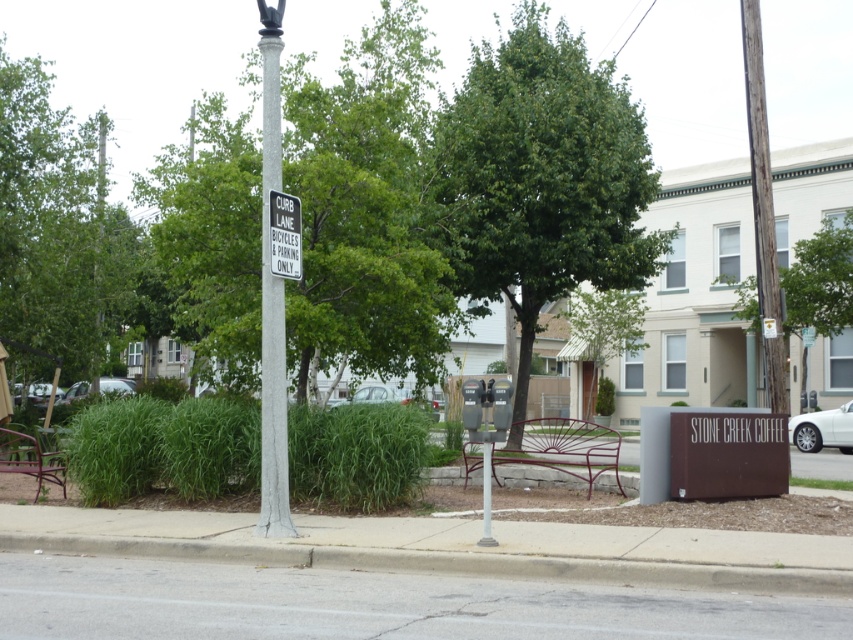
You are a city planner reviewing this urban scene. The metallic red park bench at lower left is positioned at coordinates 0.719, 0.036. If you want to place a new trash can near the bench without obstructing pedestrian pathways, where should you place it relative to the bench?

The trash can should be placed near the metallic red park bench at lower left but not in the pedestrian pathways. Since the bench is at coordinates [30,460], placing the trash can slightly to the side or behind it would ensure accessibility while avoiding obstruction.

You are a delivery person needing to park your delivery van, which is 2 meters wide, in the curb lane. The curb lane has a metallic red park bench at lower left and a metallic silver car at lower left. Can your van fit between the two vehicles if they are parked parallel to each other?

The metallic red park bench at lower left is thinner than the metallic silver car at lower left, but without knowing the exact width of the space between them, it is impossible to determine if the van can fit. The description only provides information about their relative thickness, not the available space between the two objects.